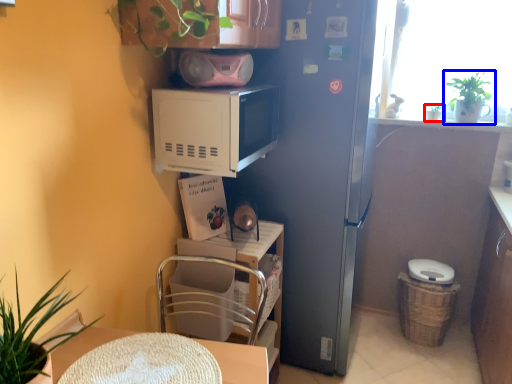
Question: Which point is further to the camera, houseplant (highlighted by a red box) or houseplant (highlighted by a blue box)?

Choices:
 (A) houseplant
 (B) houseplant

Answer: (A)